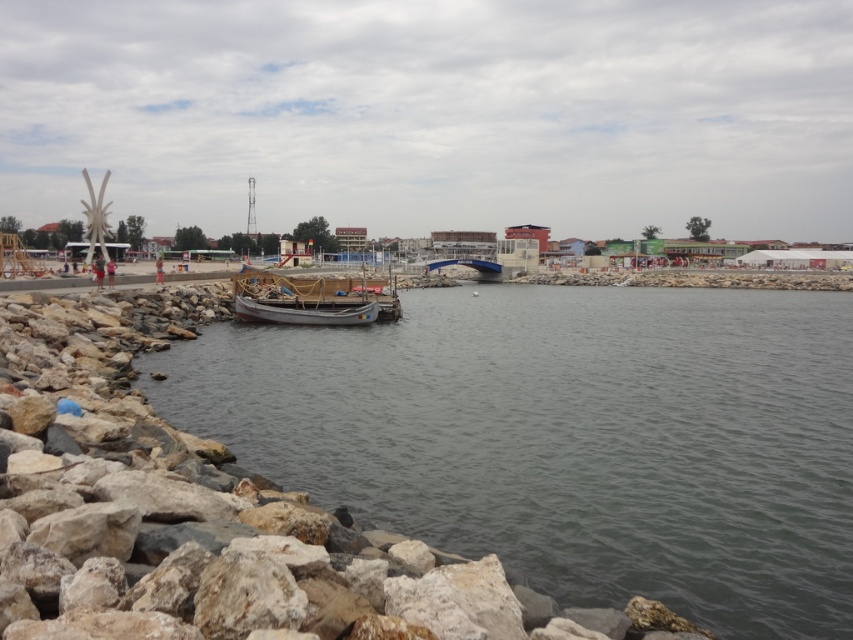
Question: Does clear water at lower left appear over wooden boat at center?

Choices:
 (A) no
 (B) yes

Answer: (A)

Question: Is the position of clear water at lower left less distant than that of wooden boat at center?

Choices:
 (A) yes
 (B) no

Answer: (A)

Question: Is clear water at lower left thinner than wooden boat at center?

Choices:
 (A) no
 (B) yes

Answer: (A)

Question: Which object is farther from the camera taking this photo?

Choices:
 (A) clear water at lower left
 (B) wooden boat at center

Answer: (B)

Question: Among these points, which one is nearest to the camera?

Choices:
 (A) (312, 280)
 (B) (717, 595)

Answer: (B)